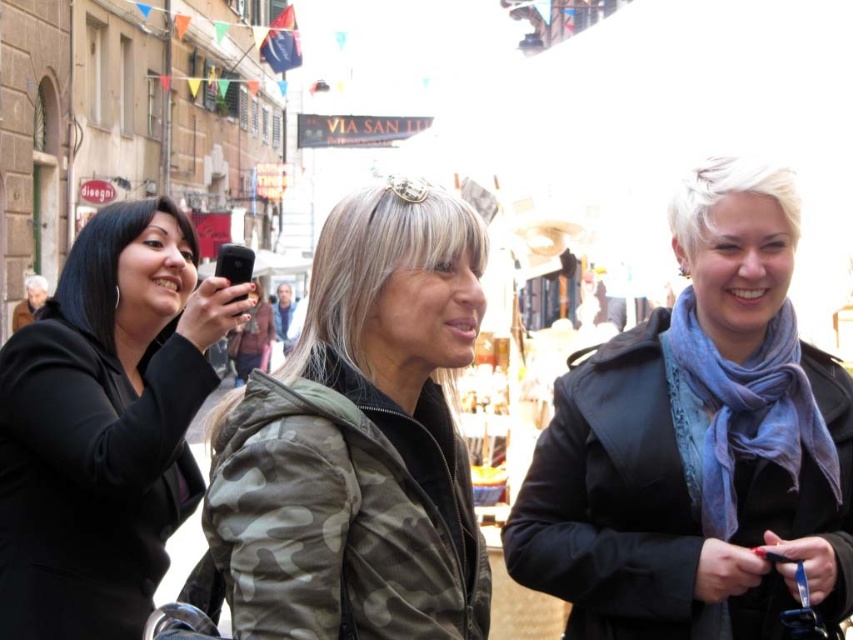
Question: Does camo-patterned jacket at center appear under black matte phone at left?

Choices:
 (A) no
 (B) yes

Answer: (B)

Question: Among these objects, which one is nearest to the camera?

Choices:
 (A) black matte phone at left
 (B) blue scarf at center

Answer: (B)

Question: Is camo-patterned jacket at center to the right of black matte phone at left from the viewer's perspective?

Choices:
 (A) yes
 (B) no

Answer: (A)

Question: In this image, where is blue scarf at center located relative to camo-patterned jacket at center?

Choices:
 (A) above
 (B) below

Answer: (B)

Question: Which point appears closest to the camera in this image?

Choices:
 (A) (749, 342)
 (B) (173, 257)
 (C) (296, 516)

Answer: (C)

Question: Considering the real-world distances, which object is closest to the camo-patterned jacket at center?

Choices:
 (A) black matte phone at left
 (B) blue scarf at center

Answer: (A)